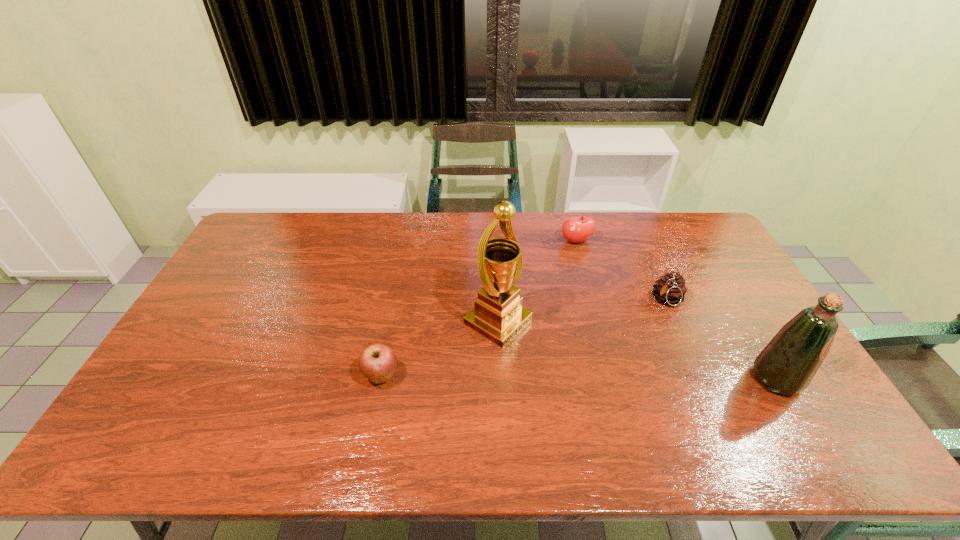
Identify the location of the nearer apple. (377, 362).

In order to click on the left apple in this screenshot , I will do `click(377, 362)`.

In order to click on the second tallest object in this screenshot , I will do tap(787, 365).

You are a GUI agent. You are given a task and a screenshot of the screen. Output one action in this format:
    pyautogui.click(x=<x>, y=<y>)
    Task: Click on the rightmost object
    
    Given the screenshot: What is the action you would take?
    pyautogui.click(x=787, y=365)

Image resolution: width=960 pixels, height=540 pixels. In order to click on the second object from right to left in this screenshot , I will do `click(670, 289)`.

Identify the location of the third object from right to left. [x=578, y=229].

At what (x,y) coordinates should I click in order to perform the action: click on the farthest object. Please return your answer as a coordinate pair (x, y). Looking at the image, I should click on [578, 229].

At what (x,y) coordinates should I click in order to perform the action: click on the tallest object. Please return your answer as a coordinate pair (x, y). Looking at the image, I should click on (498, 315).

Find the location of `the fourth object from right to left`. the fourth object from right to left is located at coordinates (498, 315).

This screenshot has height=540, width=960. What are the coordinates of `vacant space located on the right of the leftmost object` in the screenshot? It's located at (433, 376).